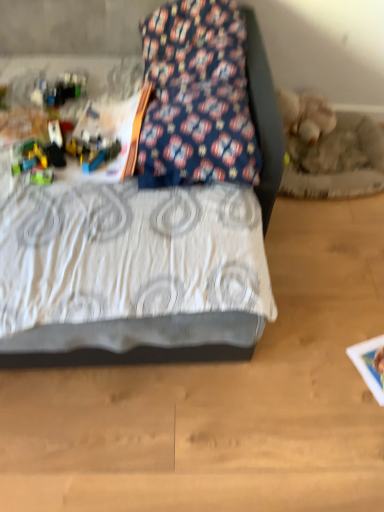
Image resolution: width=384 pixels, height=512 pixels. What do you see at coordinates (196, 97) in the screenshot?
I see `floral fabric pillow at upper center` at bounding box center [196, 97].

The width and height of the screenshot is (384, 512). What are the coordinates of `white textured bed at center` in the screenshot? It's located at (150, 342).

Does white textured bed at center have a smaller size compared to floral fabric pillow at upper center?

No, white textured bed at center is not smaller than floral fabric pillow at upper center.

Is white textured bed at center placed right next to floral fabric pillow at upper center?

white textured bed at center and floral fabric pillow at upper center are clearly separated.

Is white textured bed at center thinner than floral fabric pillow at upper center?

No, white textured bed at center is not thinner than floral fabric pillow at upper center.

Is point (204, 314) positioned behind point (223, 7)?

No, it is in front of (223, 7).

In terms of width, does translucent plastic blocks at left look wider or thinner when compared to floral fabric pillow at upper center?

In the image, translucent plastic blocks at left appears to be more narrow than floral fabric pillow at upper center.

Would you consider translucent plastic blocks at left to be distant from floral fabric pillow at upper center?

translucent plastic blocks at left is actually quite close to floral fabric pillow at upper center.

Based on their positions, is translucent plastic blocks at left located to the left or right of floral fabric pillow at upper center?

Based on their positions, translucent plastic blocks at left is located to the left of floral fabric pillow at upper center.

From a real-world perspective, is translucent plastic blocks at left below floral fabric pillow at upper center?

Indeed, from a real-world perspective, translucent plastic blocks at left is positioned beneath floral fabric pillow at upper center.

Considering the sizes of floral fabric pillow at upper center and translucent plastic blocks at left in the image, is floral fabric pillow at upper center wider or thinner than translucent plastic blocks at left?

Considering their sizes, floral fabric pillow at upper center looks broader than translucent plastic blocks at left.

Can you tell me how much floral fabric pillow at upper center and translucent plastic blocks at left differ in facing direction?

The angle between the facing direction of floral fabric pillow at upper center and the facing direction of translucent plastic blocks at left is 2.84 degrees.

Are floral fabric pillow at upper center and translucent plastic blocks at left located far from each other?

Answer: No, floral fabric pillow at upper center is in close proximity to translucent plastic blocks at left.

Locate an element on the screen. pillow located above the translucent plastic blocks at left (from a real-world perspective) is located at coordinates (196, 97).

How different are the orientations of floral fabric pillow at upper center and white textured bed at center in degrees?

The facing directions of floral fabric pillow at upper center and white textured bed at center are 0.703 degrees apart.

Between point (176, 101) and point (279, 157), which one is positioned in front?

The point (279, 157) is more forward.

Is floral fabric pillow at upper center situated inside white textured bed at center or outside?

The correct answer is: inside.

Is floral fabric pillow at upper center next to white textured bed at center?

No, floral fabric pillow at upper center is not next to white textured bed at center.

From a real-world perspective, is translucent plastic blocks at left physically below white textured bed at center?

Correct, in the physical world, translucent plastic blocks at left is lower than white textured bed at center.

Considering the sizes of objects translucent plastic blocks at left and white textured bed at center in the image provided, who is thinner, translucent plastic blocks at left or white textured bed at center?

translucent plastic blocks at left is thinner.

Is translucent plastic blocks at left oriented towards white textured bed at center?

Yes.

How different are the orientations of white textured bed at center and translucent plastic blocks at left in degrees?

The facing directions of white textured bed at center and translucent plastic blocks at left are 3.54 degrees apart.

Which object is positioned more to the right, white textured bed at center or translucent plastic blocks at left?

white textured bed at center.

In terms of size, does white textured bed at center appear bigger or smaller than translucent plastic blocks at left?

Considering their sizes, white textured bed at center takes up more space than translucent plastic blocks at left.

From the image's perspective, is white textured bed at center located above translucent plastic blocks at left?

Yes, from the image's perspective, white textured bed at center is over translucent plastic blocks at left.

Locate an element on the screen. The height and width of the screenshot is (512, 384). pillow that appears on the right of white textured bed at center is located at coordinates (196, 97).

In order to click on pillow lying in front of the translucent plastic blocks at left in this screenshot , I will do `click(196, 97)`.

Estimate the real-world distances between objects in this image. Which object is further from translucent plastic blocks at left, floral fabric pillow at upper center or white textured bed at center?

white textured bed at center lies further to translucent plastic blocks at left than the other object.

From the image, which object appears to be farther from white textured bed at center, translucent plastic blocks at left or floral fabric pillow at upper center?

floral fabric pillow at upper center is positioned further to the anchor white textured bed at center.

Which object lies further to the anchor point white textured bed at center, floral fabric pillow at upper center or translucent plastic blocks at left?

Based on the image, floral fabric pillow at upper center appears to be further to white textured bed at center.

Based on the photo, from the image, which object appears to be farther from floral fabric pillow at upper center, white textured bed at center or translucent plastic blocks at left?

white textured bed at center is further to floral fabric pillow at upper center.

From the picture: Based on their spatial positions, is translucent plastic blocks at left or white textured bed at center further from floral fabric pillow at upper center?

white textured bed at center.

Which object lies nearer to the anchor point translucent plastic blocks at left, white textured bed at center or floral fabric pillow at upper center?

Based on the image, floral fabric pillow at upper center appears to be nearer to translucent plastic blocks at left.

The width and height of the screenshot is (384, 512). What are the coordinates of `pillow between white textured bed at center and translucent plastic blocks at left in the front-back direction` in the screenshot? It's located at (196, 97).